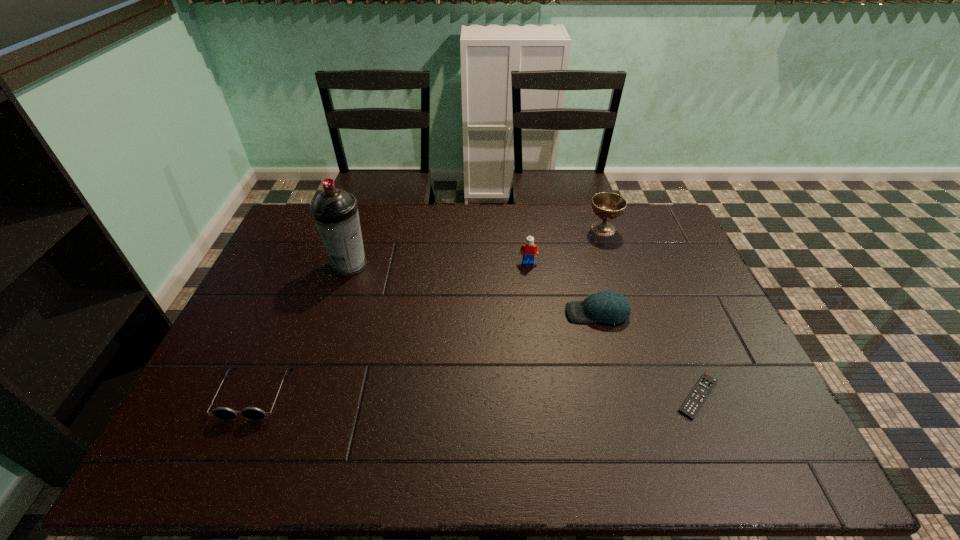
In the image, there is a desktop. Find the location of `vacant space at the far left corner`. vacant space at the far left corner is located at coordinates (307, 211).

Locate an element on the screen. free location at the far right corner is located at coordinates (660, 244).

In order to click on unoccupied position between the third shortest object and the Lego in this screenshot , I will do `click(563, 287)`.

At what (x,y) coordinates should I click in order to perform the action: click on free space between the baseball cap and the fourth object from right to left. Please return your answer as a coordinate pair (x, y). This screenshot has height=540, width=960. Looking at the image, I should click on (563, 287).

This screenshot has height=540, width=960. I want to click on free space between the chalice and the second shortest object, so click(x=429, y=311).

The height and width of the screenshot is (540, 960). I want to click on unoccupied position between the sunglasses and the fourth object from right to left, so click(392, 327).

Where is `free spot between the third nearest object and the farthest object`? This screenshot has width=960, height=540. free spot between the third nearest object and the farthest object is located at coordinates (600, 271).

Image resolution: width=960 pixels, height=540 pixels. I want to click on vacant space that's between the sunglasses and the Lego, so click(392, 327).

What are the coordinates of `free space between the third nearest object and the remote control` in the screenshot? It's located at (648, 355).

The height and width of the screenshot is (540, 960). I want to click on empty space that is in between the fifth tallest object and the chalice, so click(429, 311).